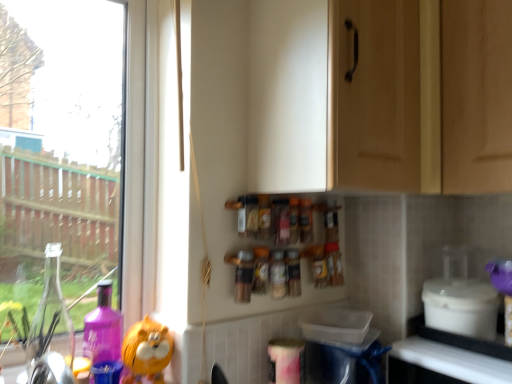
Question: From the image's perspective, does white glossy counter top at lower right appear higher than matte wood cabinet at upper center?

Choices:
 (A) yes
 (B) no

Answer: (B)

Question: Is white glossy counter top at lower right to the left of matte wood cabinet at upper center from the viewer's perspective?

Choices:
 (A) yes
 (B) no

Answer: (B)

Question: Can matte wood cabinet at upper center be found inside white glossy counter top at lower right?

Choices:
 (A) no
 (B) yes

Answer: (A)

Question: Is white glossy counter top at lower right at the right side of matte wood cabinet at upper center?

Choices:
 (A) yes
 (B) no

Answer: (A)

Question: Is white glossy counter top at lower right placed right next to matte wood cabinet at upper center?

Choices:
 (A) yes
 (B) no

Answer: (B)

Question: Considering their positions, is orange matte plush toy at lower left located in front of or behind translucent plastic spice jar at center, the first bottle from the left?

Choices:
 (A) front
 (B) behind

Answer: (A)

Question: Is point (156, 342) positioned closer to the camera than point (240, 286)?

Choices:
 (A) closer
 (B) farther

Answer: (A)

Question: Is orange matte plush toy at lower left inside the boundaries of translucent plastic spice jar at center, the first bottle from the left, or outside?

Choices:
 (A) outside
 (B) inside

Answer: (A)

Question: Considering the positions of orange matte plush toy at lower left and translucent plastic spice jar at center, the first bottle from the left, in the image, is orange matte plush toy at lower left bigger or smaller than translucent plastic spice jar at center, the first bottle from the left,?

Choices:
 (A) small
 (B) big

Answer: (B)

Question: In terms of width, does white plastic container at lower right look wider or thinner when compared to translucent plastic spice jar at center, marked as the first bottle in a right-to-left arrangement?

Choices:
 (A) thin
 (B) wide

Answer: (B)

Question: In the image, is white plastic container at lower right on the left side or the right side of translucent plastic spice jar at center, the third bottle when ordered from left to right?

Choices:
 (A) left
 (B) right

Answer: (B)

Question: Is point (498, 301) positioned closer to the camera than point (290, 273)?

Choices:
 (A) farther
 (B) closer

Answer: (B)

Question: Considering their positions, is white plastic container at lower right located in front of or behind translucent plastic spice jar at center, marked as the first bottle in a right-to-left arrangement?

Choices:
 (A) behind
 (B) front

Answer: (B)

Question: Based on their positions, is white plastic container at lower right located to the left or right of white glossy counter top at lower right?

Choices:
 (A) right
 (B) left

Answer: (B)

Question: Is white plastic container at lower right wider or thinner than white glossy counter top at lower right?

Choices:
 (A) thin
 (B) wide

Answer: (A)